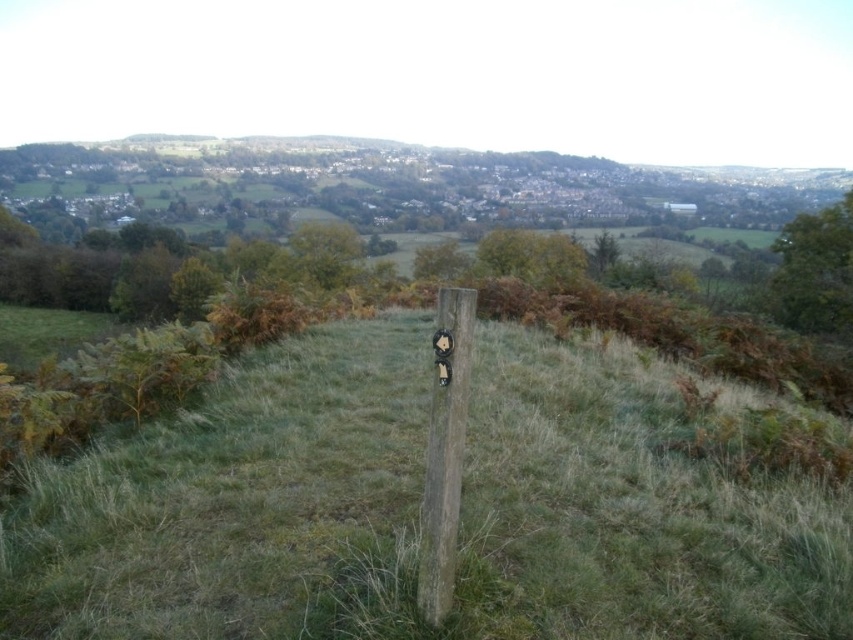
Between green grassy at center and wooden post at center, which one has less height?

With less height is green grassy at center.

Who is positioned more to the right, green grassy at center or wooden post at center?

green grassy at center

Which is in front, point (502, 394) or point (451, 518)?

Point (451, 518) is more forward.

Image resolution: width=853 pixels, height=640 pixels. Find the location of `green grassy at center`. green grassy at center is located at coordinates (241, 506).